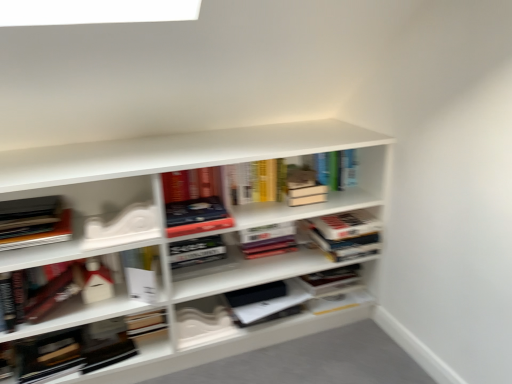
Describe the element at coordinates (141, 273) in the screenshot. I see `white paper at center, which is the third book from left to right` at that location.

You are a GUI agent. You are given a task and a screenshot of the screen. Output one action in this format:
    pyautogui.click(x=<x>, y=<y>)
    Task: Click on the hardcover book at center, which is counted as the sixth book, starting from the left
    Image resolution: width=512 pixels, height=384 pixels.
    Given the screenshot: What is the action you would take?
    pyautogui.click(x=346, y=234)

In order to face hardcover book at upper center, the second book positioned from the right, should I rotate leftwards or rightwards?

Rotate your view right by about 9.598°.

This screenshot has width=512, height=384. What do you see at coordinates (56, 283) in the screenshot?
I see `white matte box at left, acting as the 2th book starting from the left` at bounding box center [56, 283].

What are the coordinates of `matte hardcover book at center` in the screenshot? It's located at (196, 216).

Measure the distance between white matte bookshelf at center and camera.

They are 1.31 meters apart.

Where is `hardcover book at center, arranged as the 4th book when viewed from the left`? This screenshot has height=384, width=512. hardcover book at center, arranged as the 4th book when viewed from the left is located at coordinates (270, 242).

Is hardcover book at center, which is the first book in right-to-left order, wider or thinner than white matte bookshelf at center?

In the image, hardcover book at center, which is the first book in right-to-left order, appears to be more narrow than white matte bookshelf at center.

In the image, is hardcover book at center, which is counted as the sixth book, starting from the left, positioned in front of or behind white matte bookshelf at center?

Visually, hardcover book at center, which is counted as the sixth book, starting from the left, is located behind white matte bookshelf at center.

How different are the orientations of hardcover book at center, which is the first book in right-to-left order, and white matte bookshelf at center in degrees?

The angle between the facing direction of hardcover book at center, which is the first book in right-to-left order, and the facing direction of white matte bookshelf at center is 0.268 degrees.

Is hardcover book at center, which is the third book from right to left, aimed at white matte box at left, acting as the 2th book starting from the left?

No, hardcover book at center, which is the third book from right to left, does not turn towards white matte box at left, acting as the 2th book starting from the left.

Which object is positioned more to the right, hardcover book at center, which is the third book from right to left, or white matte box at left, the fifth book viewed from the right?

hardcover book at center, which is the third book from right to left, is more to the right.

Considering the relative sizes of hardcover book at center, arranged as the 4th book when viewed from the left, and white matte box at left, the fifth book viewed from the right, in the image provided, is hardcover book at center, arranged as the 4th book when viewed from the left, smaller than white matte box at left, the fifth book viewed from the right,?

Yes, hardcover book at center, arranged as the 4th book when viewed from the left, is smaller than white matte box at left, the fifth book viewed from the right.

Looking at their sizes, would you say hardcover book at center, arranged as the 4th book when viewed from the left, is wider or thinner than white matte box at left, the fifth book viewed from the right?

Considering their sizes, hardcover book at center, arranged as the 4th book when viewed from the left, looks broader than white matte box at left, the fifth book viewed from the right.

Starting from the white matte bookshelf at center, which book is the 5th one behind? Please provide its 2D coordinates.

[(270, 242)]

Does hardcover book at center, arranged as the 4th book when viewed from the left, have a greater height compared to white matte bookshelf at center?

No, hardcover book at center, arranged as the 4th book when viewed from the left, is not taller than white matte bookshelf at center.

From the image's perspective, is hardcover book at center, which is the third book from right to left, beneath white matte bookshelf at center?

Incorrect, from the image's perspective, hardcover book at center, which is the third book from right to left, is higher than white matte bookshelf at center.

Can you confirm if hardcover book at center, arranged as the 4th book when viewed from the left, is wider than white matte bookshelf at center?

No, hardcover book at center, arranged as the 4th book when viewed from the left, is not wider than white matte bookshelf at center.

Can you confirm if white matte bookshelf at center is taller than white paper at center, which appears as the fourth book when viewed from the right?

Correct, white matte bookshelf at center is much taller as white paper at center, which appears as the fourth book when viewed from the right.

From the image's perspective, would you say white matte bookshelf at center is positioned over white paper at center, which appears as the fourth book when viewed from the right?

Yes, from the image's perspective, white matte bookshelf at center is above white paper at center, which appears as the fourth book when viewed from the right.

Is white matte bookshelf at center next to white paper at center, which appears as the fourth book when viewed from the right, and touching it?

No, white matte bookshelf at center is not with white paper at center, which appears as the fourth book when viewed from the right.

How different are the orientations of white matte bookshelf at center and white paper at center, which is the third book from left to right, in degrees?

1.51 degrees.

Measure the distance from hardcover book at center, arranged as the 4th book when viewed from the left, to hardcover book at center, which is the first book in right-to-left order.

hardcover book at center, arranged as the 4th book when viewed from the left, and hardcover book at center, which is the first book in right-to-left order, are 8.77 inches apart.

Is the depth of hardcover book at center, arranged as the 4th book when viewed from the left, greater than that of hardcover book at center, which is the first book in right-to-left order?

That is True.

Is hardcover book at center, arranged as the 4th book when viewed from the left, taller or shorter than hardcover book at center, which is the first book in right-to-left order?

Clearly, hardcover book at center, arranged as the 4th book when viewed from the left, is shorter compared to hardcover book at center, which is the first book in right-to-left order.

From a real-world perspective, is hardcover book at upper center, the second book positioned from the right, positioned above or below hardcover book at center, arranged as the 4th book when viewed from the left?

Clearly, from a real-world perspective, hardcover book at upper center, the second book positioned from the right, is above hardcover book at center, arranged as the 4th book when viewed from the left.

Is hardcover book at upper center, the second book positioned from the right, completely or partially outside of hardcover book at center, which is the third book from right to left?

Yes, hardcover book at upper center, the second book positioned from the right, is outside of hardcover book at center, which is the third book from right to left.

Which is in front, hardcover book at upper center, arranged as the 5th book when viewed from the left, or hardcover book at center, arranged as the 4th book when viewed from the left?

hardcover book at center, arranged as the 4th book when viewed from the left, is closer to the camera.

How distant is hardcover book at center, which is the third book from right to left, from hardcover book at upper center, the second book positioned from the right?

hardcover book at center, which is the third book from right to left, and hardcover book at upper center, the second book positioned from the right, are 13.12 inches apart.

Is point (269, 230) positioned before point (354, 175)?

No.

From the image's perspective, is hardcover book at center, which is the third book from right to left, located beneath hardcover book at upper center, the second book positioned from the right?

Correct, hardcover book at center, which is the third book from right to left, appears lower than hardcover book at upper center, the second book positioned from the right, in the image.

Looking at their sizes, would you say hardcover book at center, which is the third book from right to left, is wider or thinner than hardcover book at upper center, the second book positioned from the right?

Clearly, hardcover book at center, which is the third book from right to left, has less width compared to hardcover book at upper center, the second book positioned from the right.

This screenshot has width=512, height=384. What are the coordinates of `shelf that appears on the left of hardcover book at center, which is the first book in right-to-left order` in the screenshot? It's located at (184, 235).

From the image's perspective, count 1st books downward from the hardcover book at center, which is the third book from right to left, and point to it. Please provide its 2D coordinates.

[(56, 283)]

Estimate the real-world distances between objects in this image. Which object is further from hardcover book at center, arranged as the 4th book when viewed from the left, hardcover book at center, which is counted as the sixth book, starting from the left, or white paper at center, which appears as the fourth book when viewed from the right?

Based on the image, white paper at center, which appears as the fourth book when viewed from the right, appears to be further to hardcover book at center, arranged as the 4th book when viewed from the left.

Which object lies nearer to the anchor point white paper at center, which is the third book from left to right, white matte bookshelf at center or hardcover book at center, which is counted as the sixth book, starting from the left?

Among the two, white matte bookshelf at center is located nearer to white paper at center, which is the third book from left to right.

When comparing their distances from hardcover book at upper center, arranged as the 5th book when viewed from the left, does hardcover book at center, which is the first book in right-to-left order, or white paper at center, which is the third book from left to right, seem further?

Based on the image, white paper at center, which is the third book from left to right, appears to be further to hardcover book at upper center, arranged as the 5th book when viewed from the left.

Which object lies further to the anchor point white matte box at left, the fifth book viewed from the right, matte black book at left, which is the first book in left-to-right order, or white paper at center, which is the third book from left to right?

The object further to white matte box at left, the fifth book viewed from the right, is matte black book at left, which is the first book in left-to-right order.

When comparing their distances from matte black book at left, placed as the 6th book when sorted from right to left, does hardcover book at center, which is the first book in right-to-left order, or hardcover book at center, which is the third book from right to left, seem closer?

hardcover book at center, which is the third book from right to left, is closer to matte black book at left, placed as the 6th book when sorted from right to left.

Estimate the real-world distances between objects in this image. Which object is further from white paper at center, which is the third book from left to right, matte black book at left, placed as the 6th book when sorted from right to left, or white matte box at left, the fifth book viewed from the right?

matte black book at left, placed as the 6th book when sorted from right to left, is further to white paper at center, which is the third book from left to right.

From the image, which object appears to be nearer to hardcover book at center, arranged as the 4th book when viewed from the left, matte hardcover book at center or hardcover book at center, which is the first book in right-to-left order?

hardcover book at center, which is the first book in right-to-left order.

Which object lies nearer to the anchor point white matte box at left, the fifth book viewed from the right, hardcover book at center, which is the first book in right-to-left order, or matte hardcover book at center?

matte hardcover book at center lies closer to white matte box at left, the fifth book viewed from the right, than the other object.

I want to click on book between hardcover book at center, which is the third book from right to left, and hardcover book at center, which is counted as the sixth book, starting from the left, so click(x=336, y=169).

Locate an element on the screen. The image size is (512, 384). shelf situated between matte black book at left, placed as the 6th book when sorted from right to left, and hardcover book at center, which is the first book in right-to-left order, from left to right is located at coordinates (184, 235).

Locate an element on the screen. The width and height of the screenshot is (512, 384). shelf between white matte box at left, acting as the 2th book starting from the left, and hardcover book at center, which is counted as the sixth book, starting from the left, from left to right is located at coordinates (184, 235).

I want to click on shelf situated between white matte box at left, acting as the 2th book starting from the left, and matte hardcover book at center from left to right, so click(x=184, y=235).